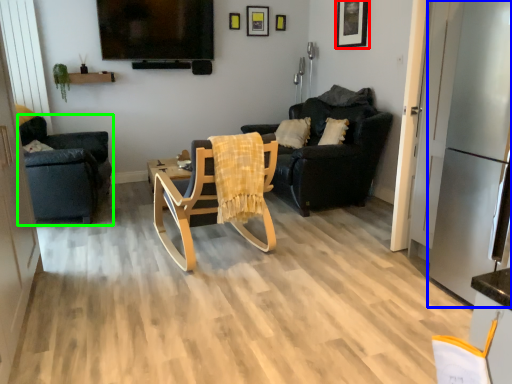
Question: Which object is positioned closest to picture frame (highlighted by a red box)? Select from appliance (highlighted by a blue box) and chair (highlighted by a green box).

Choices:
 (A) appliance
 (B) chair

Answer: (A)